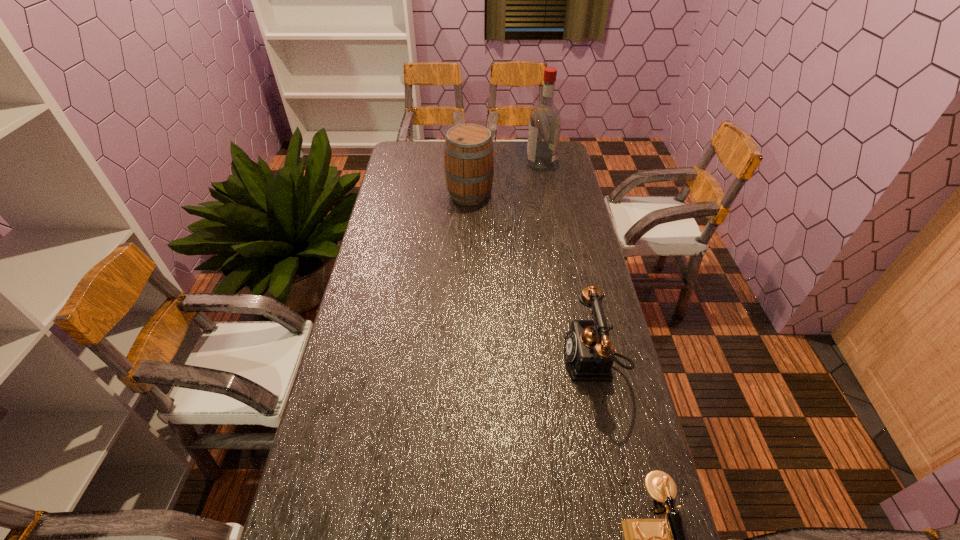
I want to click on liquor, so (x=545, y=121).

Locate an element on the screen. the farthest object is located at coordinates (545, 121).

I want to click on cider, so click(x=468, y=151).

In order to click on the second farthest object in this screenshot , I will do `click(468, 151)`.

Locate an element on the screen. The height and width of the screenshot is (540, 960). the farther telephone is located at coordinates (590, 354).

Identify the location of vacant space located on the front-facing side of the liquor. The width and height of the screenshot is (960, 540). (460, 163).

In order to click on free location located 0.290m on the front-facing side of the liquor in this screenshot , I will do `click(464, 163)`.

Where is `vacant space located on the front-facing side of the liquor`? Image resolution: width=960 pixels, height=540 pixels. vacant space located on the front-facing side of the liquor is located at coordinates (479, 163).

Find the location of a particular element. This screenshot has width=960, height=540. blank space located 0.340m on the back of the third nearest object is located at coordinates (471, 142).

I want to click on free location located on the front of the second nearest object at the rotary dial, so click(x=501, y=360).